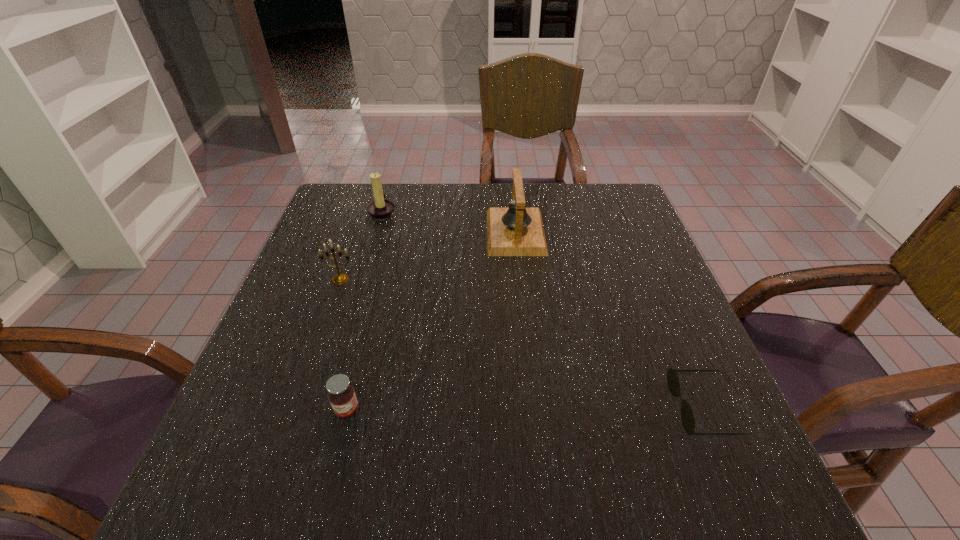
Identify the location of the second object from right to left. Image resolution: width=960 pixels, height=540 pixels. (515, 231).

Where is `the farther candelabrum`? the farther candelabrum is located at coordinates (380, 209).

Find the location of a particular element. The width and height of the screenshot is (960, 540). the nearer candelabrum is located at coordinates (339, 279).

Image resolution: width=960 pixels, height=540 pixels. In order to click on jam in this screenshot , I will do `click(342, 397)`.

You are a GUI agent. You are given a task and a screenshot of the screen. Output one action in this format:
    pyautogui.click(x=<x>, y=<y>)
    Task: Click on the shortest object
    Image resolution: width=960 pixels, height=540 pixels.
    Given the screenshot: What is the action you would take?
    pyautogui.click(x=673, y=383)

The height and width of the screenshot is (540, 960). I want to click on the rightmost object, so click(673, 383).

The width and height of the screenshot is (960, 540). Identify the location of free space located 0.150m on the left of the bell. (432, 232).

The image size is (960, 540). Find the location of `vacant space situated on the wick of the farther candelabrum`. vacant space situated on the wick of the farther candelabrum is located at coordinates (472, 212).

I want to click on free spot located 0.350m on the right of the third nearest object, so click(500, 279).

I want to click on vacant space located 0.060m on the label side of the second shortest object, so click(336, 454).